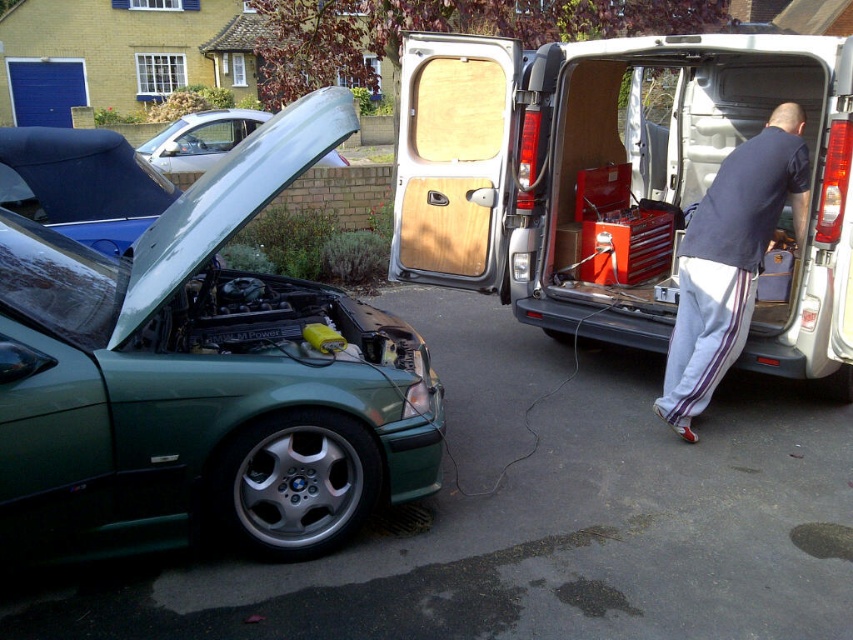
Question: Can you confirm if green metallic car at left is positioned to the right of dark blue t-shirt at center?

Choices:
 (A) no
 (B) yes

Answer: (A)

Question: Is silver metallic van at right thinner than dark blue t-shirt at center?

Choices:
 (A) no
 (B) yes

Answer: (A)

Question: Among these points, which one is nearest to the camera?

Choices:
 (A) (267, 113)
 (B) (579, 157)
 (C) (705, 333)

Answer: (C)

Question: Considering the relative positions of green metallic car at left and silver metallic car at upper left in the image provided, where is green metallic car at left located with respect to silver metallic car at upper left?

Choices:
 (A) below
 (B) above

Answer: (A)

Question: Considering the real-world distances, which object is closest to the dark blue t-shirt at center?

Choices:
 (A) silver metallic van at right
 (B) silver metallic car at upper left
 (C) green metallic car at left

Answer: (A)

Question: Which point is closer to the camera?

Choices:
 (A) (165, 150)
 (B) (631, 68)
 (C) (677, 285)
 (D) (299, 355)

Answer: (D)